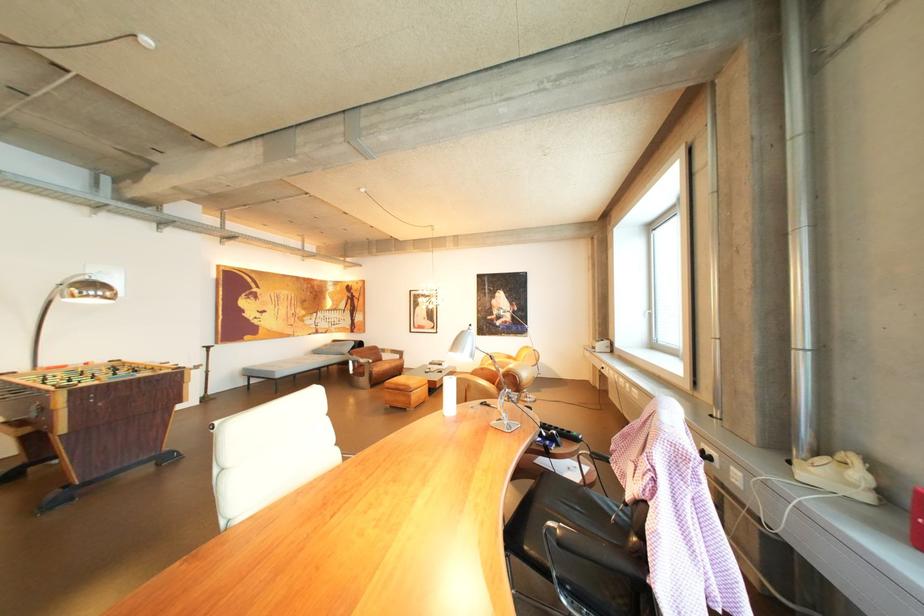
Locate an element on the screen. chrome lamp head is located at coordinates (89, 292).